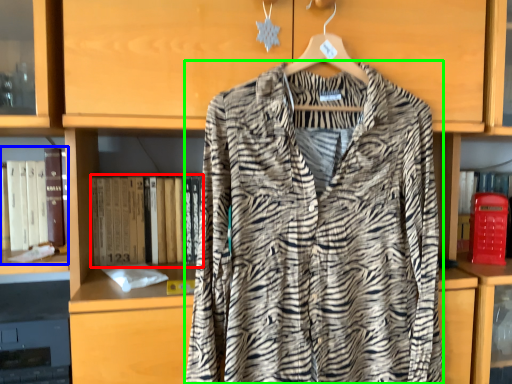
Question: Estimate the real-world distances between objects in this image. Which object is closer to book (highlighted by a red box), book (highlighted by a blue box) or fancy dress (highlighted by a green box)?

Choices:
 (A) book
 (B) fancy dress

Answer: (A)